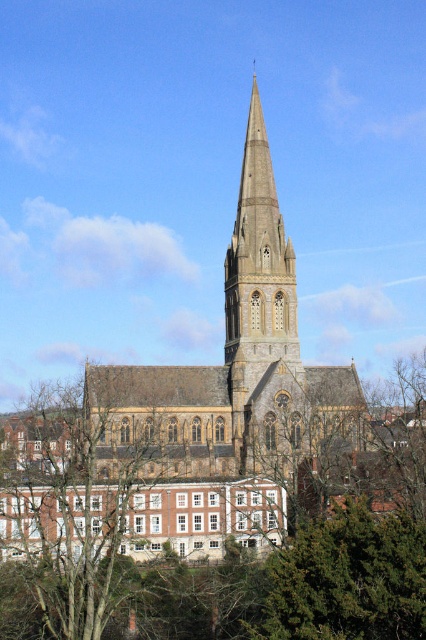
Between green leafy tree at center and brown wood tree at lower left, which one is positioned lower?

brown wood tree at lower left

Does green leafy tree at center appear under brown wood tree at lower left?

No, green leafy tree at center is not below brown wood tree at lower left.

Is point (244, 429) positioned after point (60, 468)?

Yes, point (244, 429) is farther from viewer.

You are a GUI agent. You are given a task and a screenshot of the screen. Output one action in this format:
    pyautogui.click(x=<x>, y=<y>)
    Task: Click on the green leafy tree at center
    The width and height of the screenshot is (426, 640).
    Given the screenshot: What is the action you would take?
    (x=218, y=493)